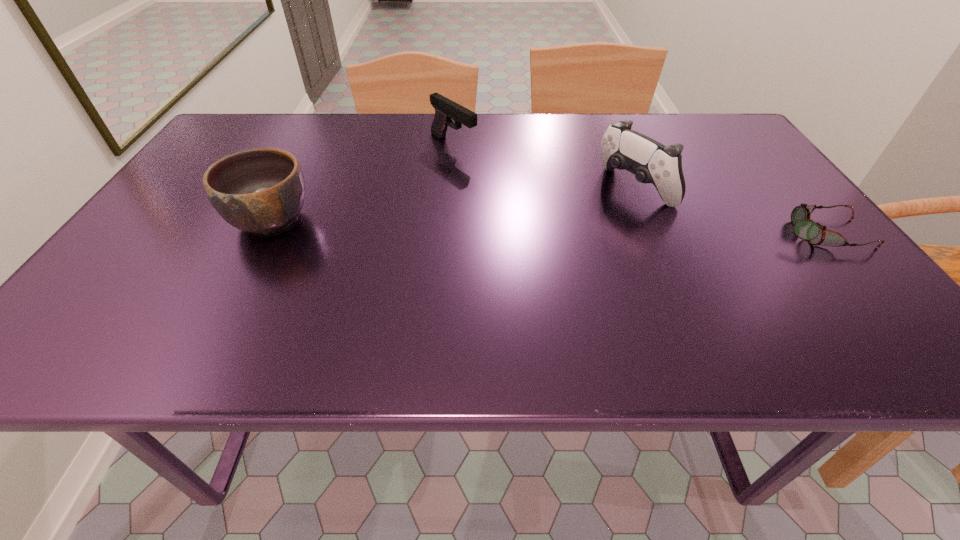
Select which object is the third closest to the second object from left to right. Please provide its 2D coordinates. Your answer should be formatted as a tuple, i.e. [(x, y)], where the tuple contains the x and y coordinates of a point satisfying the conditions above.

[(804, 228)]

The image size is (960, 540). In order to click on the second closest object to the shortest object in this screenshot , I will do `click(445, 109)`.

Find the location of a particular element. The image size is (960, 540). vacant space that satisfies the following two spatial constraints: 1. on the back side of the third object from left to right; 2. on the right side of the leftmost object is located at coordinates (288, 188).

Identify the location of vacant point that satisfies the following two spatial constraints: 1. on the front side of the spectacles; 2. on the front-facing side of the pistol. (446, 233).

The width and height of the screenshot is (960, 540). What are the coordinates of `vacant space that satisfies the following two spatial constraints: 1. on the front side of the rightmost object; 2. on the front-facing side of the second object from right to left` in the screenshot? It's located at (653, 233).

This screenshot has height=540, width=960. Find the location of `vacant space that satisfies the following two spatial constraints: 1. on the front side of the pistol; 2. on the front-facing side of the shortest object`. vacant space that satisfies the following two spatial constraints: 1. on the front side of the pistol; 2. on the front-facing side of the shortest object is located at coordinates (446, 233).

Locate an element on the screen. free space that satisfies the following two spatial constraints: 1. on the back side of the control; 2. on the left side of the bowl is located at coordinates (288, 188).

Locate an element on the screen. This screenshot has width=960, height=540. blank area in the image that satisfies the following two spatial constraints: 1. on the back side of the pistol; 2. on the right side of the bowl is located at coordinates (311, 144).